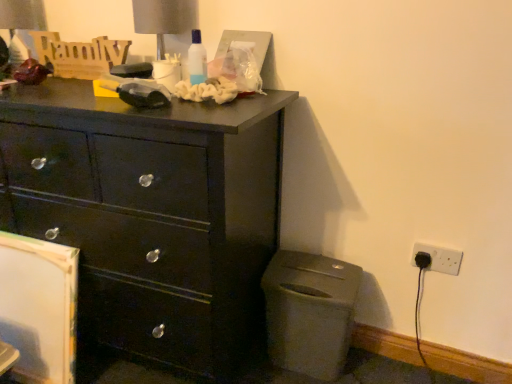
Question: Should I look upward or downward to see matte black chest of drawers at left?

Choices:
 (A) down
 (B) up

Answer: (A)

Question: Considering the relative sizes of white plastic electrical outlet at lower right, which is the 2th electric outlet in left-to-right order, and black plastic electric outlet at lower right, the second electric outlet when ordered from right to left, in the image provided, is white plastic electrical outlet at lower right, which is the 2th electric outlet in left-to-right order, taller than black plastic electric outlet at lower right, the second electric outlet when ordered from right to left,?

Choices:
 (A) no
 (B) yes

Answer: (B)

Question: From the image's perspective, is white plastic electrical outlet at lower right, which is the 2th electric outlet in left-to-right order, on black plastic electric outlet at lower right, the second electric outlet when ordered from right to left?

Choices:
 (A) yes
 (B) no

Answer: (A)

Question: From the image's perspective, does white plastic electrical outlet at lower right, which is counted as the first electric outlet, starting from the right, appear lower than black plastic electric outlet at lower right, the second electric outlet when ordered from right to left?

Choices:
 (A) yes
 (B) no

Answer: (B)

Question: Is the depth of white plastic electrical outlet at lower right, which is counted as the first electric outlet, starting from the right, less than that of black plastic electric outlet at lower right, the second electric outlet when ordered from right to left?

Choices:
 (A) yes
 (B) no

Answer: (A)

Question: Considering the relative positions of white plastic electrical outlet at lower right, which is the 2th electric outlet in left-to-right order, and black plastic electric outlet at lower right, which is the 1th electric outlet in left-to-right order, in the image provided, is white plastic electrical outlet at lower right, which is the 2th electric outlet in left-to-right order, to the right of black plastic electric outlet at lower right, which is the 1th electric outlet in left-to-right order, from the viewer's perspective?

Choices:
 (A) no
 (B) yes

Answer: (B)

Question: Can you confirm if white plastic electrical outlet at lower right, which is counted as the first electric outlet, starting from the right, is wider than black plastic electric outlet at lower right, which is the 1th electric outlet in left-to-right order?

Choices:
 (A) yes
 (B) no

Answer: (B)

Question: Considering the relative sizes of metallic gray table lamp at upper center and matte black chest of drawers at left in the image provided, is metallic gray table lamp at upper center shorter than matte black chest of drawers at left?

Choices:
 (A) yes
 (B) no

Answer: (A)

Question: Could you tell me if metallic gray table lamp at upper center is facing matte black chest of drawers at left?

Choices:
 (A) no
 (B) yes

Answer: (A)

Question: Is metallic gray table lamp at upper center taller than matte black chest of drawers at left?

Choices:
 (A) no
 (B) yes

Answer: (A)

Question: From the image's perspective, is metallic gray table lamp at upper center located beneath matte black chest of drawers at left?

Choices:
 (A) yes
 (B) no

Answer: (B)

Question: Is metallic gray table lamp at upper center turned away from matte black chest of drawers at left?

Choices:
 (A) yes
 (B) no

Answer: (B)

Question: Does metallic gray table lamp at upper center touch matte black chest of drawers at left?

Choices:
 (A) no
 (B) yes

Answer: (A)

Question: Would you say matte black chest of drawers at left is part of white plastic electrical outlet at lower right, which is counted as the first electric outlet, starting from the right,'s contents?

Choices:
 (A) no
 (B) yes

Answer: (A)